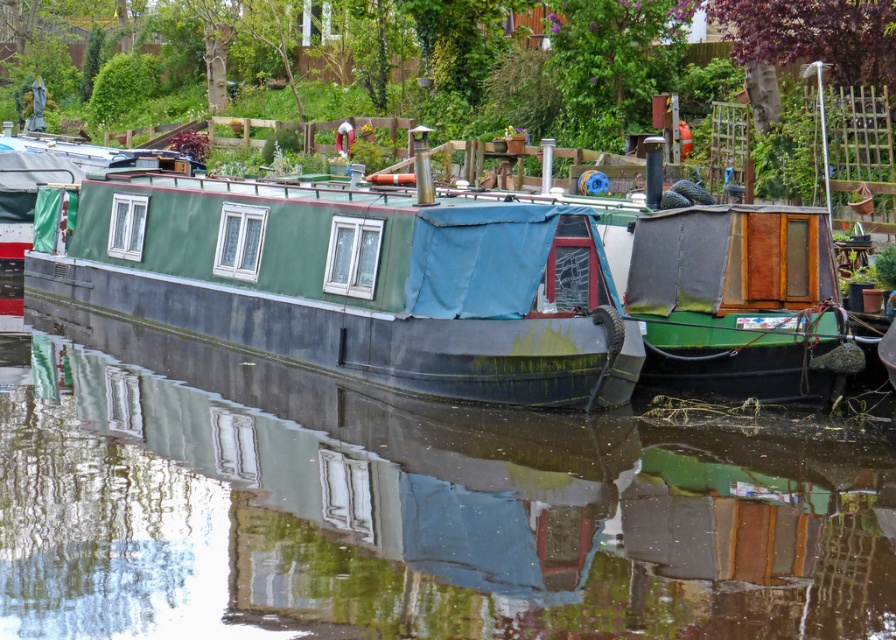
Question: Estimate the real-world distances between objects in this image. Which object is closer to the green matte houseboat at center?

Choices:
 (A) green matte boat at center
 (B) green canvas boat at right

Answer: (A)

Question: Which point is farther from the camera taking this photo?

Choices:
 (A) (674, 301)
 (B) (153, 385)

Answer: (B)

Question: Can you confirm if green matte boat at center is thinner than green canvas boat at right?

Choices:
 (A) no
 (B) yes

Answer: (A)

Question: Does green matte boat at center have a lesser width compared to green canvas boat at right?

Choices:
 (A) yes
 (B) no

Answer: (B)

Question: Estimate the real-world distances between objects in this image. Which object is farther from the green canvas boat at right?

Choices:
 (A) green matte houseboat at center
 (B) green matte boat at center

Answer: (B)

Question: Does green matte boat at center appear over green canvas boat at right?

Choices:
 (A) no
 (B) yes

Answer: (A)